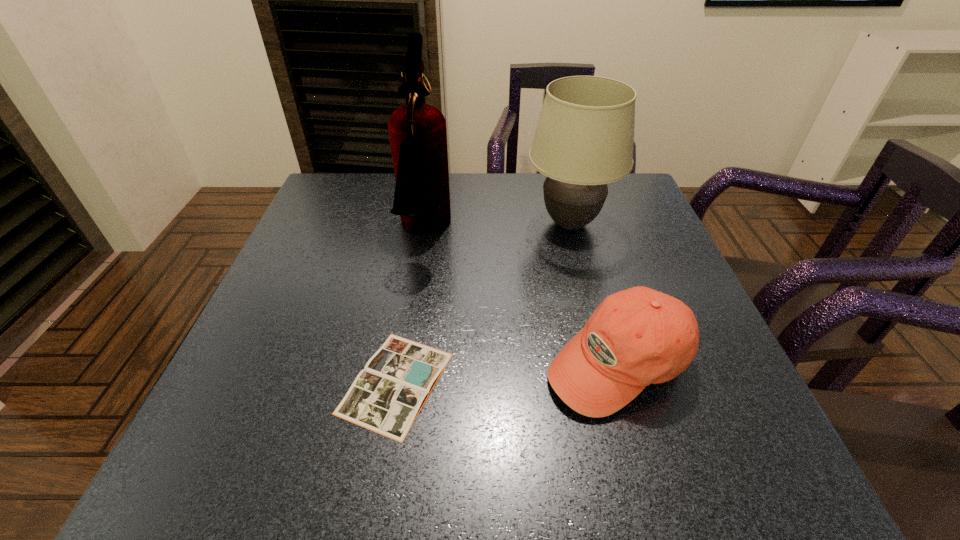
Locate an element on the screen. The height and width of the screenshot is (540, 960). free space between the fire extinguisher and the third tallest object is located at coordinates (521, 297).

Find the location of a particular element. The width and height of the screenshot is (960, 540). free space between the tallest object and the second tallest object is located at coordinates (497, 228).

Find the location of `free spot between the third shortest object and the shortest object`. free spot between the third shortest object and the shortest object is located at coordinates (483, 303).

Where is `free spot between the book and the second tallest object`? free spot between the book and the second tallest object is located at coordinates (483, 303).

The height and width of the screenshot is (540, 960). What are the coordinates of `empty space between the baseball cap and the book` in the screenshot? It's located at [x=507, y=373].

This screenshot has height=540, width=960. Find the location of `free space between the third tallest object and the shortest object`. free space between the third tallest object and the shortest object is located at coordinates (507, 373).

Find the location of a particular element. empty location between the lampshade and the shortest object is located at coordinates (483, 303).

This screenshot has height=540, width=960. In order to click on free space between the tallest object and the book in this screenshot , I will do `click(410, 307)`.

Identify the location of free space between the lampshade and the fire extinguisher. (497, 228).

Locate an element on the screen. vacant space that is in between the baseball cap and the fire extinguisher is located at coordinates (521, 297).